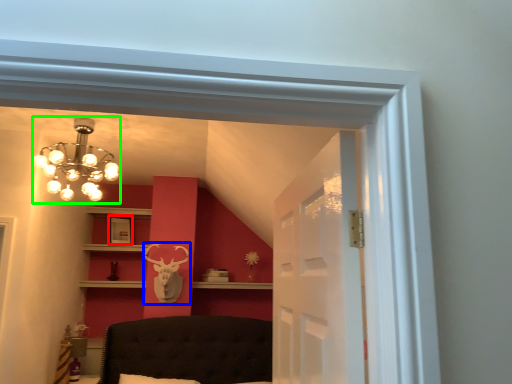
Question: Which object is the closest to the picture frame (highlighted by a red box)? Choose among these: deer (highlighted by a blue box) or lamp (highlighted by a green box).

Choices:
 (A) deer
 (B) lamp

Answer: (A)